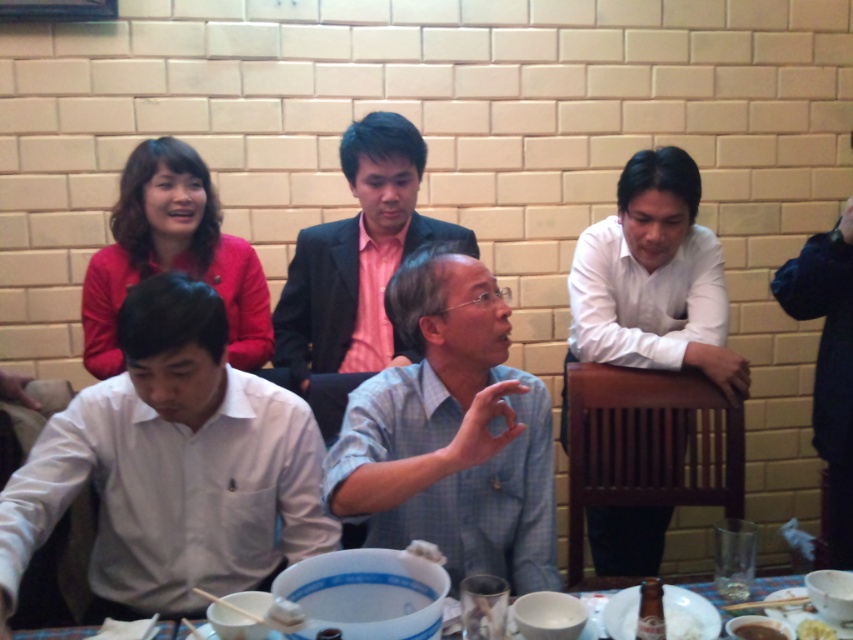
You are a photographer trying to capture a closeup shot of the brown matte bowl at lower center without including the gray checkered shirt at center in the frame. Given their sizes, is this feasible?

The gray checkered shirt at center is bigger than the brown matte bowl at lower center. Therefore, it might be challenging to exclude the gray checkered shirt at center from the frame if the bowl is positioned centrally, as the shirt could still appear in the background or edges depending on the camera angle and zoom.